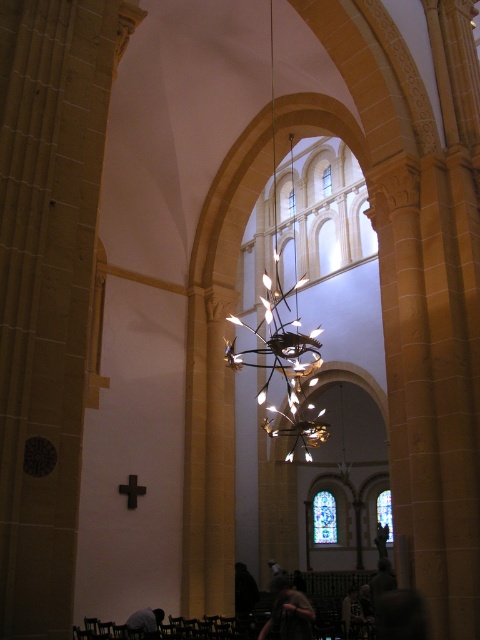
Who is positioned more to the left, dark brown leather jacket at lower center or dark gray fabric at lower center?

From the viewer's perspective, dark gray fabric at lower center appears more on the left side.

Does dark brown leather jacket at lower center have a lesser height compared to dark gray fabric at lower center?

Incorrect, dark brown leather jacket at lower center's height does not fall short of dark gray fabric at lower center's.

Which is in front, point (311, 620) or point (137, 618)?

Positioned in front is point (311, 620).

Image resolution: width=480 pixels, height=640 pixels. In order to click on dark brown leather jacket at lower center in this screenshot , I will do `click(288, 611)`.